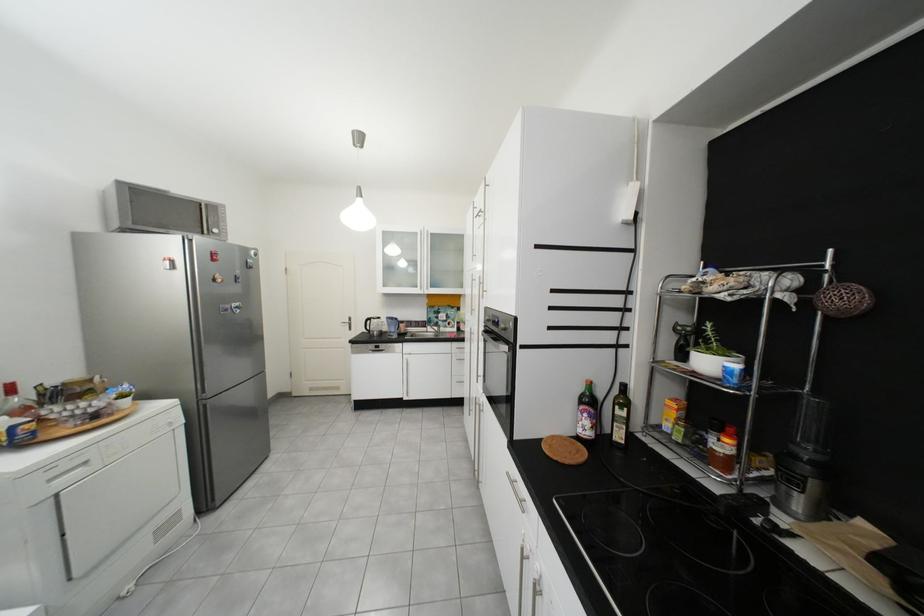
You are a GUI agent. You are given a task and a screenshot of the screen. Output one action in this format:
    pyautogui.click(x=<x>, y=<y>)
    Task: Click on the dryer door handle
    This screenshot has width=924, height=616.
    Given the screenshot: What is the action you would take?
    pyautogui.click(x=231, y=308)